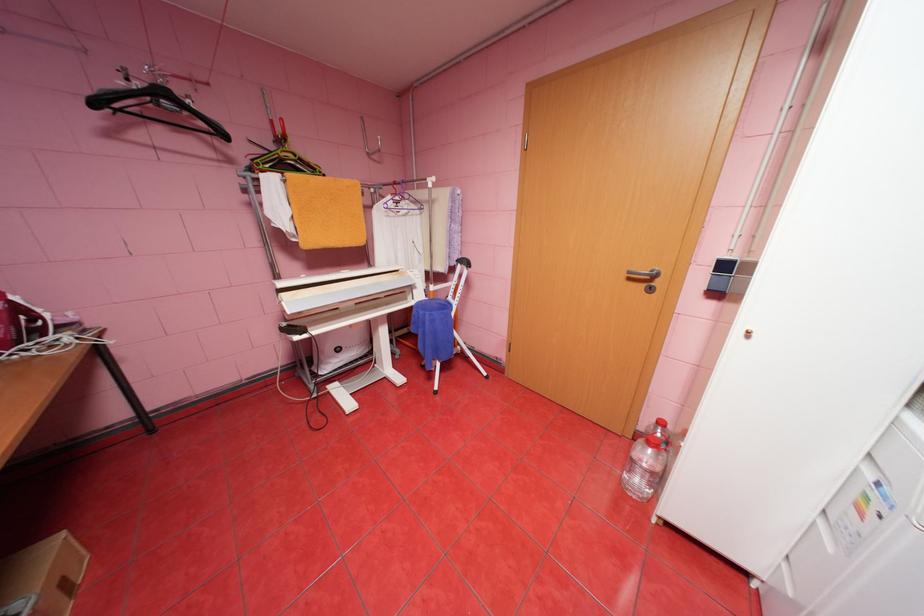
Which object does [152,102] point to?

It corresponds to the purple clothes hanger in the image.